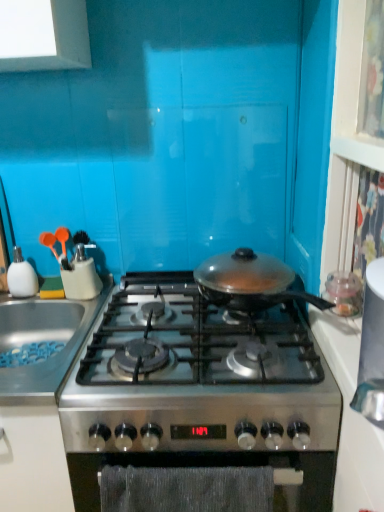
Question: Is stainless steel sink at left taller or shorter than white glossy soap dispenser at left?

Choices:
 (A) short
 (B) tall

Answer: (A)

Question: Is point (4, 318) closer or farther from the camera than point (29, 287)?

Choices:
 (A) closer
 (B) farther

Answer: (A)

Question: Which object is positioned closest to the stainless steel sink at left?

Choices:
 (A) white glossy countertop at right
 (B) stainless steel gas stove at center
 (C) textured gray oven at center
 (D) white glossy soap dispenser at left

Answer: (D)

Question: Which is nearer to the stainless steel gas stove at center?

Choices:
 (A) stainless steel sink at left
 (B) white glossy soap dispenser at left
 (C) white glossy countertop at right
 (D) textured gray oven at center

Answer: (D)